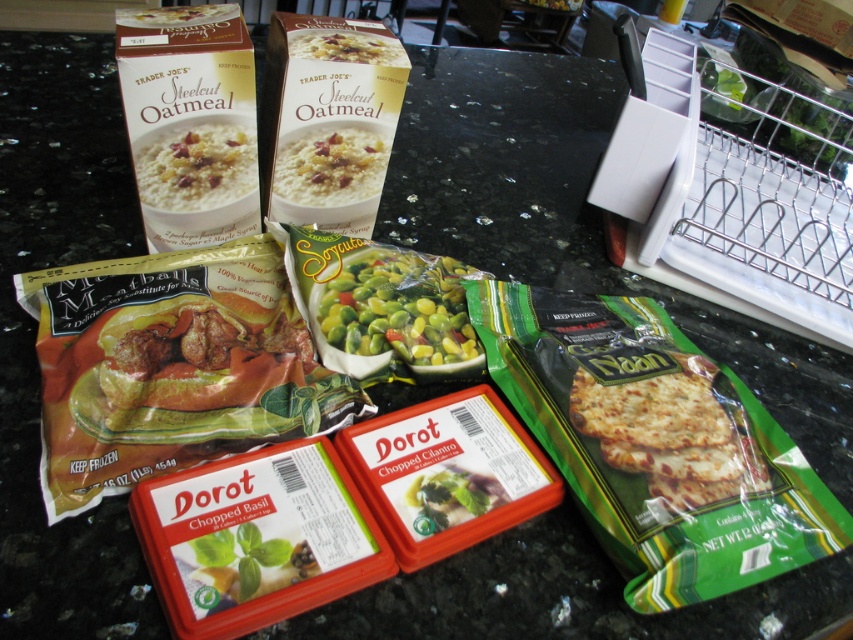
From the picture: Between green matte frozen peas at center and white matte oatmeal at center, which one appears on the left side from the viewer's perspective?

From the viewer's perspective, white matte oatmeal at center appears more on the left side.

Does green matte frozen peas at center have a smaller size compared to white matte oatmeal at center?

No, green matte frozen peas at center is not smaller than white matte oatmeal at center.

In order to click on green matte frozen peas at center in this screenshot , I will do `click(399, 308)`.

Is point (415, 342) more distant than point (343, 45)?

No, it is not.

Can you confirm if green matte frozen peas at center is bigger than white matte steel cut oatmeal at upper center?

Yes, green matte frozen peas at center is bigger than white matte steel cut oatmeal at upper center.

Where is `green matte frozen peas at center`? This screenshot has height=640, width=853. green matte frozen peas at center is located at coordinates (399, 308).

Does white matte oatmeal at center have a lesser width compared to white matte steel cut oatmeal at upper center?

No, white matte oatmeal at center is not thinner than white matte steel cut oatmeal at upper center.

Between white matte oatmeal at center and white matte steel cut oatmeal at upper center, which one has less height?

Standing shorter between the two is white matte steel cut oatmeal at upper center.

Is point (303, 180) closer to camera compared to point (300, 49)?

No, it is behind (300, 49).

This screenshot has height=640, width=853. Find the location of `white matte oatmeal at center`. white matte oatmeal at center is located at coordinates (329, 166).